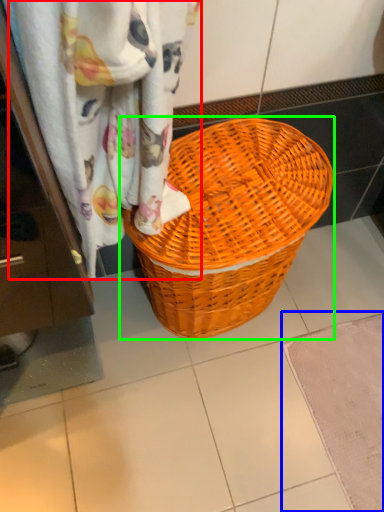
Question: Based on their relative distances, which object is nearer to curtain (highlighted by a red box)? Choose from bath mat (highlighted by a blue box) and picnic basket (highlighted by a green box).

Choices:
 (A) bath mat
 (B) picnic basket

Answer: (B)